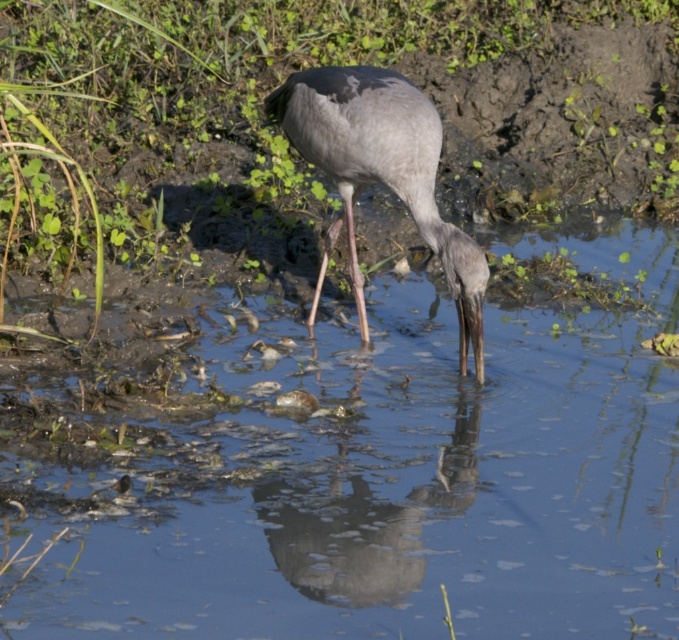
You are standing at the edge of the water in the image. There is a point marked at coordinates (388, 481). What is the nature of the area at this point?

The point at coordinates (388, 481) corresponds to clear water at center, which is part of the shallow water where the bird is standing.

You are a photographer trying to capture the reflection of the bird in the clear water at center. Based on the scene description, where should you position your camera to ensure the reflection is fully visible in the photo?

The clear water at center is located at point (388, 481), so you should position your camera directly above or facing that coordinate to capture the reflection fully.

You are a wildlife photographer aiming to capture the reflection of the gray matte bird at center in the clear water at center. You need to position your camera so that the bird and its reflection are both in focus. Given that the depth of field required is 30 inches, will you be able to achieve this with your current setup?

The distance between the clear water at center and the gray matte bird at center is 29.06 inches, which is within the required 30 inches depth of field. Therefore, you can achieve both the bird and its reflection in focus with your current setup.